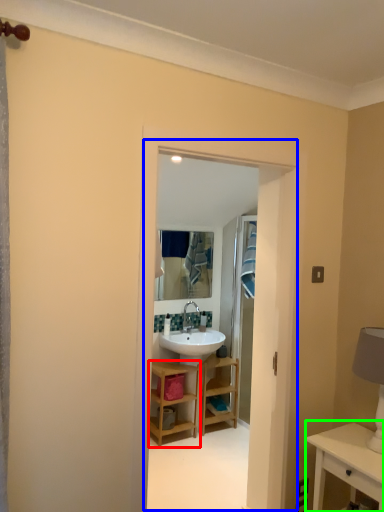
Question: Estimate the real-world distances between objects in this image. Which object is closer to bathroom cabinet (highlighted by a red box), residence (highlighted by a blue box) or table (highlighted by a green box)?

Choices:
 (A) residence
 (B) table

Answer: (A)